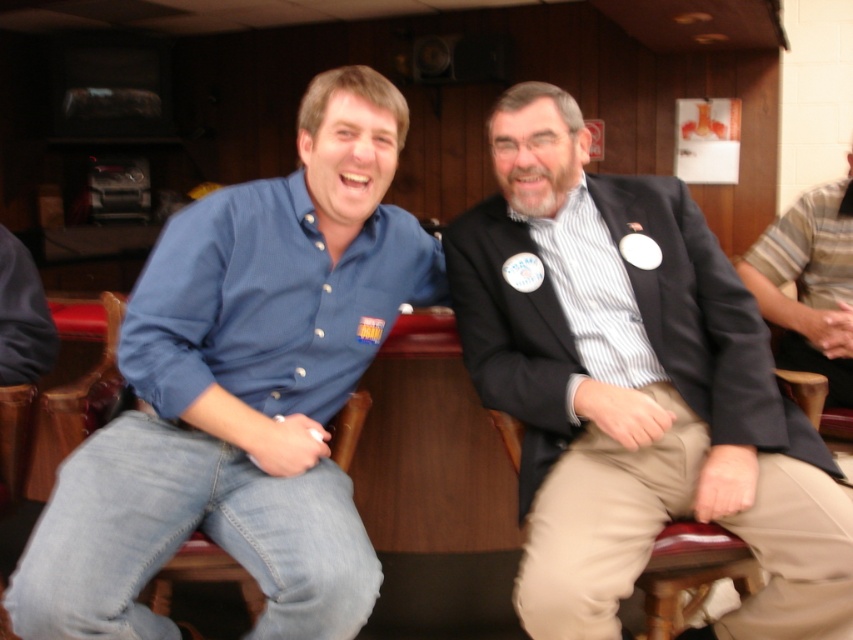
Question: From the image, what is the correct spatial relationship of striped cotton shirt at right in relation to striped cotton shirt at center?

Choices:
 (A) below
 (B) above

Answer: (B)

Question: Which point appears closest to the camera in this image?

Choices:
 (A) (85, 493)
 (B) (762, 620)
 (C) (828, 216)

Answer: (A)

Question: Estimate the real-world distances between objects in this image. Which object is farther from the blue denim jeans at left?

Choices:
 (A) striped cotton shirt at right
 (B) khaki pants at center

Answer: (A)

Question: Is blue denim jeans at left above striped cotton shirt at right?

Choices:
 (A) no
 (B) yes

Answer: (A)

Question: Which of the following is the closest to the observer?

Choices:
 (A) (846, 220)
 (B) (763, 634)
 (C) (604, 340)

Answer: (B)

Question: Does matte black blazer at center have a smaller size compared to blue denim jeans at left?

Choices:
 (A) no
 (B) yes

Answer: (B)